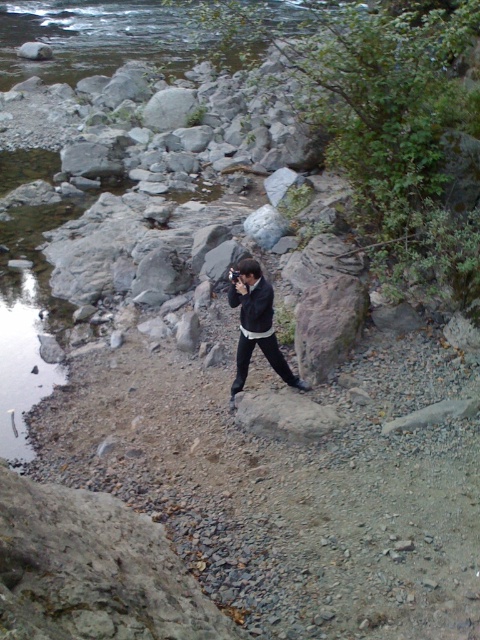
You are standing at the point marked by the coordinates point (x=327, y=324) in the image. What type of surface are you currently standing on?

The point (x=327, y=324) is on gray rough rock at center.